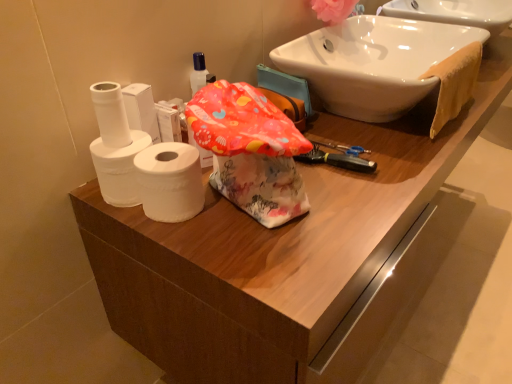
At what (x,y) coordinates should I click in order to perform the action: click on vacant space that is to the left of orange cloth towel at upper right. Please return your answer as a coordinate pair (x, y). The height and width of the screenshot is (384, 512). Looking at the image, I should click on (355, 131).